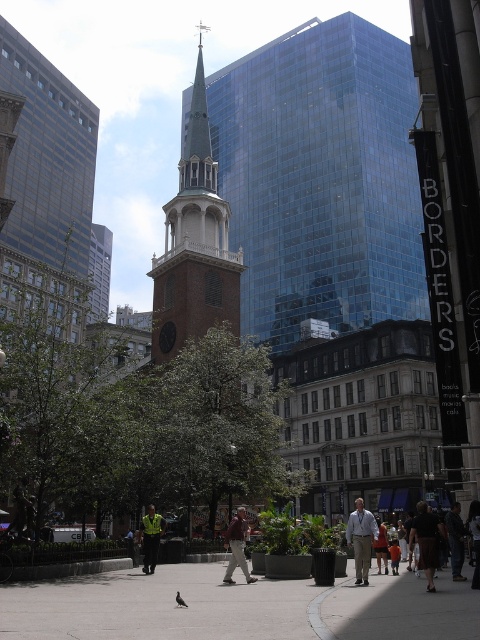
Does green leafy tree at center have a greater height compared to orange cotton shirt at center?

Correct, green leafy tree at center is much taller as orange cotton shirt at center.

Can you confirm if green leafy tree at center is smaller than orange cotton shirt at center?

No.

Which is behind, point (116, 362) or point (382, 540)?

The point (116, 362) is more distant.

Find the location of a particular element. The height and width of the screenshot is (640, 480). green leafy tree at center is located at coordinates (140, 426).

Which is below, brown brick steeple at center or dark brown leather jacket at lower right?

dark brown leather jacket at lower right is lower down.

Describe the element at coordinates (194, 244) in the screenshot. This screenshot has width=480, height=640. I see `brown brick steeple at center` at that location.

The height and width of the screenshot is (640, 480). What are the coordinates of `brown brick steeple at center` in the screenshot? It's located at (194, 244).

Can you confirm if green leafy tree at center is wider than brown brick steeple at center?

Yes.

Which of these two, green leafy tree at center or brown brick steeple at center, stands taller?

Standing taller between the two is brown brick steeple at center.

Locate an element on the screen. green leafy tree at center is located at coordinates (140, 426).

The width and height of the screenshot is (480, 640). I want to click on green leafy tree at center, so click(140, 426).